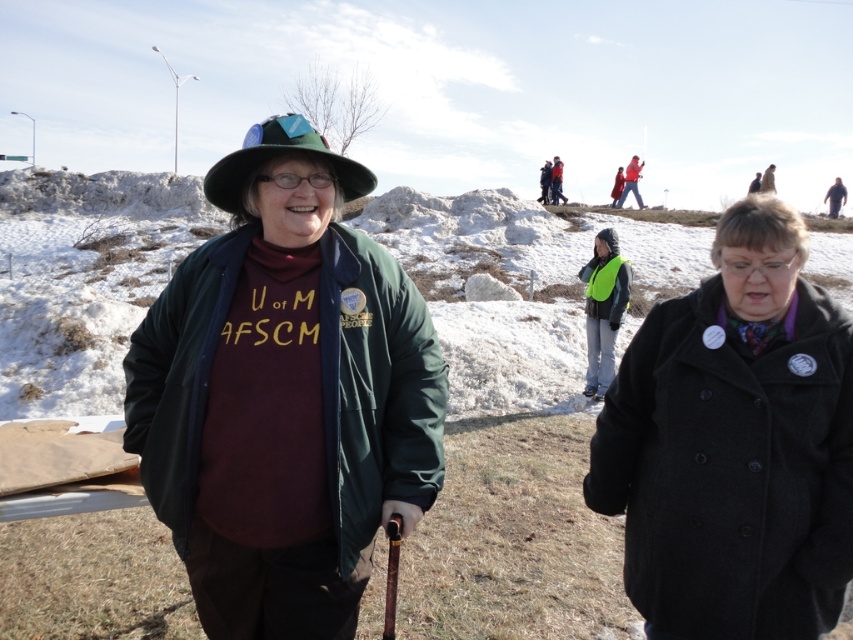
You are standing at the edge of the snowy hill at center and want to walk towards the green felt hat at center. In which direction should you head?

You should head to the right because the snowy hill at center is to the left of the green felt hat at center, so moving right from the snowy hill at center will lead you toward the green felt hat at center.

Based on the photo, you are standing at the origin point of the coordinate system. You want to walk to the black wool coat at center. Which direction should you move in the x and y axes?

To reach the black wool coat at center located at coordinate point [734,444], you should move in the positive x and positive y directions since both coordinates are greater than zero.

You are a photographer trying to capture both the green matte jacket at center and the red wool sweater at upper center in a single frame. Which object should you focus on first to ensure both are in the frame?

The green matte jacket at center has a lesser height compared to the red wool sweater at upper center, so you should focus on the red wool sweater at upper center first to ensure both are in the frame.